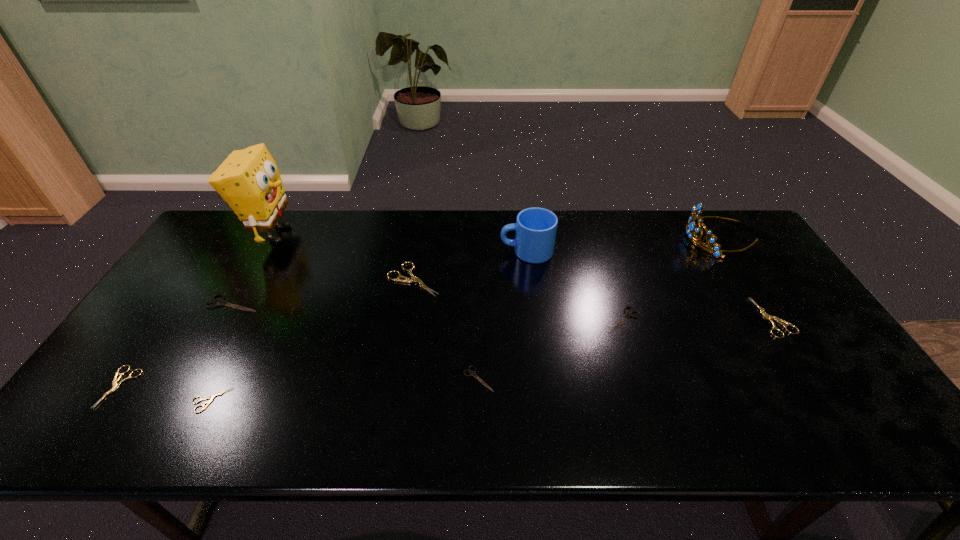
Image resolution: width=960 pixels, height=540 pixels. I want to click on free region located on the front-facing side of the tiara, so point(617,238).

Find the location of a particular element. This screenshot has height=540, width=960. free spot located 0.170m on the side of the mug with the handle is located at coordinates (447, 251).

Where is `vacant space located on the side of the mug with the handle`? vacant space located on the side of the mug with the handle is located at coordinates (469, 251).

Identify the location of vacant region located 0.100m on the side of the mug with the handle. This screenshot has height=540, width=960. (469, 251).

The image size is (960, 540). I want to click on free space located 0.230m on the front of the biggest black shears, so click(189, 382).

At what (x,y) coordinates should I click in order to perform the action: click on vacant space located 0.320m on the front of the third beige shears from left to right. Please return your answer as a coordinate pair (x, y). Image resolution: width=960 pixels, height=540 pixels. Looking at the image, I should click on (395, 394).

At what (x,y) coordinates should I click in order to perform the action: click on free space located 0.190m on the right of the rightmost black shears. Please return your answer as a coordinate pair (x, y). This screenshot has width=960, height=540. Looking at the image, I should click on (711, 320).

Locate an element on the screen. Image resolution: width=960 pixels, height=540 pixels. vacant space located 0.240m on the front of the rightmost beige shears is located at coordinates (842, 423).

This screenshot has width=960, height=540. What are the coordinates of `free space located on the back of the leftmost object` in the screenshot? It's located at (179, 302).

Locate an element on the screen. The image size is (960, 540). vacant space situated on the back of the nearest black shears is located at coordinates (478, 344).